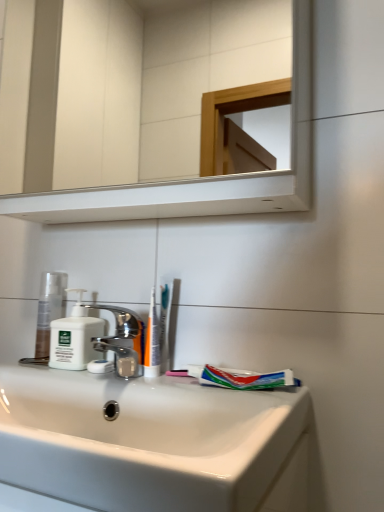
Question: Is point (145, 338) positioned closer to the camera than point (8, 77)?

Choices:
 (A) farther
 (B) closer

Answer: (B)

Question: Which is correct: white plastic toothbrush at center is inside white glossy mirror at upper center, or outside of it?

Choices:
 (A) inside
 (B) outside

Answer: (B)

Question: Estimate the real-world distances between objects in this image. Which object is farther from the polished chrome faucet at center?

Choices:
 (A) white glossy sink at lower center
 (B) white plastic toothbrush at center
 (C) multicolored plastic toothpaste at lower center
 (D) matte white lotion at left
 (E) white matte soap dispenser at left

Answer: (A)

Question: Which object is positioned farthest from the matte white lotion at left?

Choices:
 (A) white plastic toothbrush at center
 (B) white glossy sink at lower center
 (C) white glossy mirror at upper center
 (D) polished chrome faucet at center
 (E) white matte soap dispenser at left

Answer: (C)